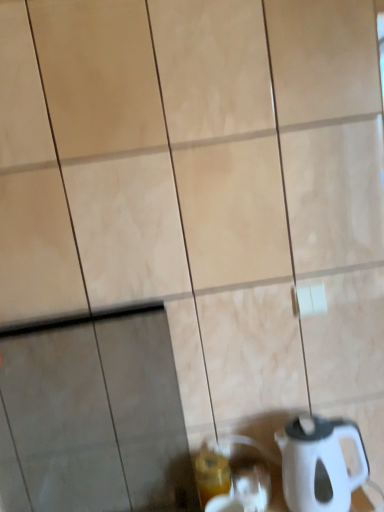
At what (x,y) coordinates should I click in order to perform the action: click on white plastic kettle at lower right. Please return your answer as a coordinate pair (x, y). Looking at the image, I should click on (319, 463).

What do you see at coordinates (319, 463) in the screenshot? This screenshot has height=512, width=384. I see `white plastic kettle at lower right` at bounding box center [319, 463].

The width and height of the screenshot is (384, 512). What do you see at coordinates (212, 475) in the screenshot? I see `translucent glass beverage at lower center` at bounding box center [212, 475].

Where is `translucent glass beverage at lower center`? The width and height of the screenshot is (384, 512). translucent glass beverage at lower center is located at coordinates (212, 475).

What are the coordinates of `white plastic kettle at lower right` in the screenshot? It's located at (319, 463).

Can you confirm if translucent glass beverage at lower center is positioned to the right of white plastic kettle at lower right?

No, translucent glass beverage at lower center is not to the right of white plastic kettle at lower right.

Considering the positions of objects translucent glass beverage at lower center and white plastic kettle at lower right in the image provided, who is behind, translucent glass beverage at lower center or white plastic kettle at lower right?

translucent glass beverage at lower center is further from the camera.

Which is further, (216, 495) or (338, 489)?

Positioned behind is point (216, 495).

From the image's perspective, between translucent glass beverage at lower center and white plastic kettle at lower right, who is located below?

translucent glass beverage at lower center is shown below in the image.

From the picture: From a real-world perspective, relative to white plastic kettle at lower right, is translucent glass beverage at lower center vertically above or below?

From a real-world perspective, translucent glass beverage at lower center is physically below white plastic kettle at lower right.

Considering the sizes of translucent glass beverage at lower center and white plastic kettle at lower right in the image, is translucent glass beverage at lower center wider or thinner than white plastic kettle at lower right?

Clearly, translucent glass beverage at lower center has less width compared to white plastic kettle at lower right.

From their relative heights in the image, would you say translucent glass beverage at lower center is taller or shorter than white plastic kettle at lower right?

Clearly, translucent glass beverage at lower center is shorter compared to white plastic kettle at lower right.

Can you confirm if translucent glass beverage at lower center is bigger than white plastic kettle at lower right?

Incorrect, translucent glass beverage at lower center is not larger than white plastic kettle at lower right.

Is translucent glass beverage at lower center outside of white plastic kettle at lower right?

Yes, translucent glass beverage at lower center is outside of white plastic kettle at lower right.

Is translucent glass beverage at lower center far from white plastic kettle at lower right?

translucent glass beverage at lower center is near white plastic kettle at lower right, not far away.

Is translucent glass beverage at lower center aimed at white plastic kettle at lower right?

No.

Where is `kettle above the translucent glass beverage at lower center (from the image's perspective)`? kettle above the translucent glass beverage at lower center (from the image's perspective) is located at coordinates (319, 463).

Which is more to the left, white plastic kettle at lower right or translucent glass beverage at lower center?

translucent glass beverage at lower center is more to the left.

Considering the relative positions of white plastic kettle at lower right and translucent glass beverage at lower center in the image provided, is white plastic kettle at lower right behind translucent glass beverage at lower center?

No, it is in front of translucent glass beverage at lower center.

Which is closer to the camera, [306,501] or [198,476]?

Point [306,501] is closer to the camera than point [198,476].

From the picture: From the image's perspective, between white plastic kettle at lower right and translucent glass beverage at lower center, which one is located above?

From the image's view, white plastic kettle at lower right is above.

From a real-world perspective, is white plastic kettle at lower right physically below translucent glass beverage at lower center?

No, from a real-world perspective, white plastic kettle at lower right is not below translucent glass beverage at lower center.

Which of these two, white plastic kettle at lower right or translucent glass beverage at lower center, is thinner?

translucent glass beverage at lower center is thinner.

Between white plastic kettle at lower right and translucent glass beverage at lower center, which one has less height?

Standing shorter between the two is translucent glass beverage at lower center.

Does white plastic kettle at lower right have a larger size compared to translucent glass beverage at lower center?

Correct, white plastic kettle at lower right is larger in size than translucent glass beverage at lower center.

Is white plastic kettle at lower right outside of translucent glass beverage at lower center?

Answer: Yes.

Are white plastic kettle at lower right and translucent glass beverage at lower center located far from each other?

white plastic kettle at lower right is near translucent glass beverage at lower center, not far away.

Based on the photo, is white plastic kettle at lower right looking in the opposite direction of translucent glass beverage at lower center?

That's not correct — white plastic kettle at lower right is not looking away from translucent glass beverage at lower center.

Where is `kettle in front of the translucent glass beverage at lower center`? kettle in front of the translucent glass beverage at lower center is located at coordinates (319, 463).

Locate an element on the screen. kettle on the right of the translucent glass beverage at lower center is located at coordinates (319, 463).

In the image, there is a white plastic kettle at lower right. Identify the location of beverage below it (from a real-world perspective). Image resolution: width=384 pixels, height=512 pixels. (212, 475).